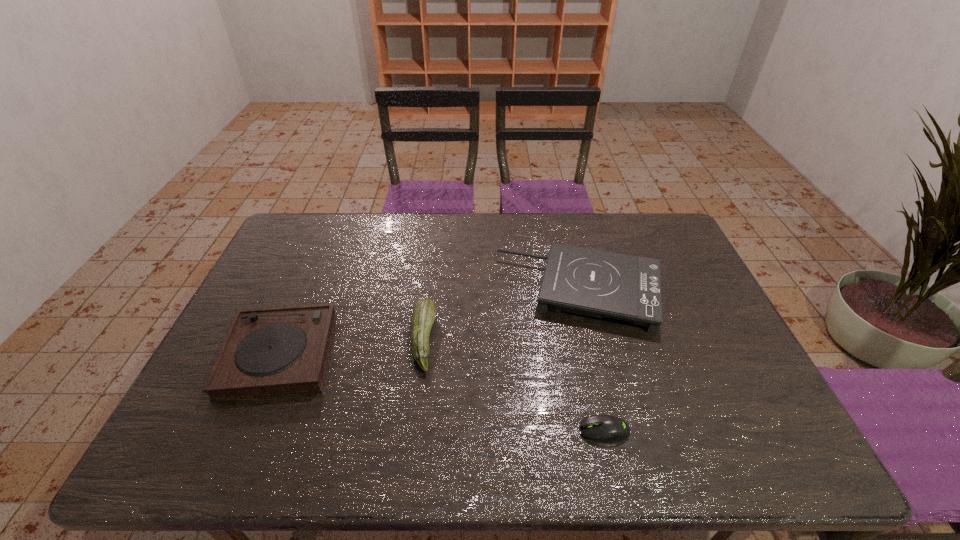
You are a GUI agent. You are given a task and a screenshot of the screen. Output one action in this format:
    pyautogui.click(x=<x>, y=<y>)
    Task: Click on the vacant area that lies between the zucchini and the leftmost object
    
    Given the screenshot: What is the action you would take?
    pyautogui.click(x=351, y=347)

You are a GUI agent. You are given a task and a screenshot of the screen. Output one action in this format:
    pyautogui.click(x=<x>, y=<y>)
    Task: Click on the free space between the zucchini and the hotplate
    The width and height of the screenshot is (960, 540).
    Given the screenshot: What is the action you would take?
    pyautogui.click(x=502, y=316)

The width and height of the screenshot is (960, 540). Identify the location of free area in between the zucchini and the phonograph record. (351, 347).

Where is `vacant region between the computer mouse and the zucchini`? The height and width of the screenshot is (540, 960). vacant region between the computer mouse and the zucchini is located at coordinates (514, 385).

Where is `free space between the leftmost object and the second object from left to right`? The width and height of the screenshot is (960, 540). free space between the leftmost object and the second object from left to right is located at coordinates (351, 347).

Locate an element on the screen. This screenshot has width=960, height=540. vacant area that lies between the computer mouse and the hotplate is located at coordinates (592, 361).

You are a GUI agent. You are given a task and a screenshot of the screen. Output one action in this format:
    pyautogui.click(x=<x>, y=<y>)
    Task: Click on the vacant point located between the leftmost object and the zucchini
    This screenshot has width=960, height=540.
    Given the screenshot: What is the action you would take?
    pyautogui.click(x=351, y=347)

The image size is (960, 540). Identify the location of unoccupied area between the zucchini and the hotplate. (502, 316).

Identify the location of object that is the third closest to the leftmost object. The width and height of the screenshot is (960, 540). (602, 428).

Identify which object is the third nearest to the leftmost object. Please provide its 2D coordinates. Your answer should be formatted as a tuple, i.e. [(x, y)], where the tuple contains the x and y coordinates of a point satisfying the conditions above.

[(602, 428)]